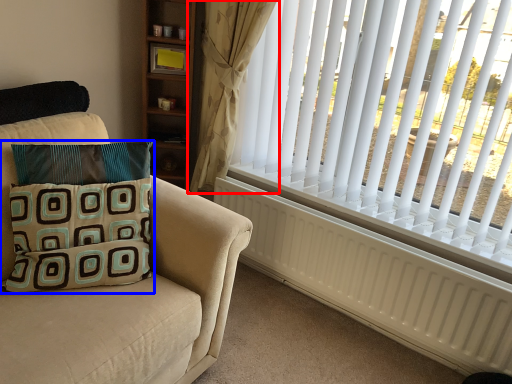
Question: Which object is closer to the camera taking this photo, curtain (highlighted by a red box) or pillow (highlighted by a blue box)?

Choices:
 (A) curtain
 (B) pillow

Answer: (B)